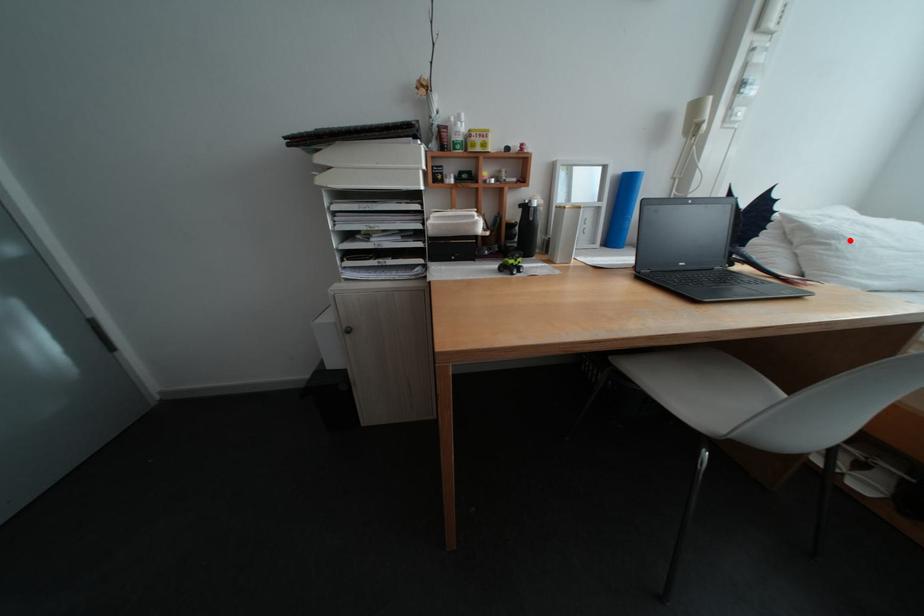
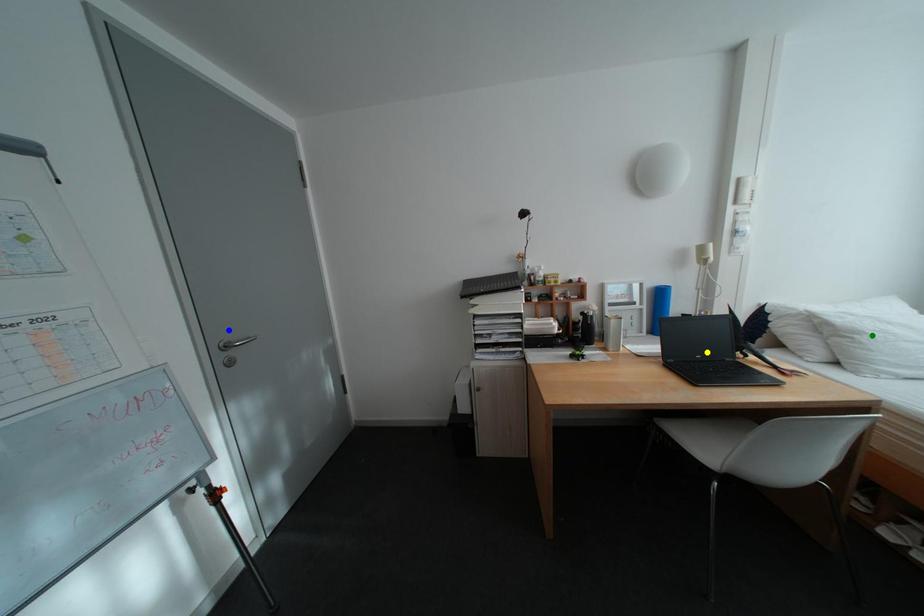
Question: I am providing you with two images of the same scene from different viewpoints. A red point is marked on the first image. You are given multiple points on the second image. Which point in image 2 represents the same 3d spot as the red point in image 1?

Choices:
 (A) yellow point
 (B) green point
 (C) blue point

Answer: (B)